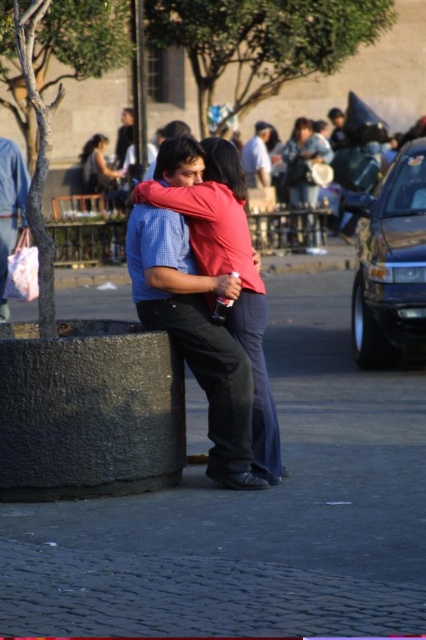
Does matte blue shirt at left appear on the right side of light blue shirt at center?

Incorrect, matte blue shirt at left is not on the right side of light blue shirt at center.

Does matte blue shirt at left appear under light blue shirt at center?

Indeed, matte blue shirt at left is positioned under light blue shirt at center.

Which is behind, point (11, 170) or point (264, 157)?

The point (264, 157) is more distant.

Identify the location of matte blue shirt at left. (9, 209).

Can you confirm if matte pink sweater at upper center is positioned below light blue shirt at center?

Correct, matte pink sweater at upper center is located below light blue shirt at center.

Does point (290, 147) come closer to viewer compared to point (259, 154)?

No, (290, 147) is further to viewer.

Where is `matte pink sweater at upper center`? The height and width of the screenshot is (640, 426). matte pink sweater at upper center is located at coordinates (305, 176).

Between matte pink sweater at upper left and light blue shirt at center, which one appears on the left side from the viewer's perspective?

matte pink sweater at upper left

Is point (108, 182) in front of point (259, 179)?

Yes, point (108, 182) is closer to viewer.

Locate an element on the screen. matte pink sweater at upper left is located at coordinates (97, 168).